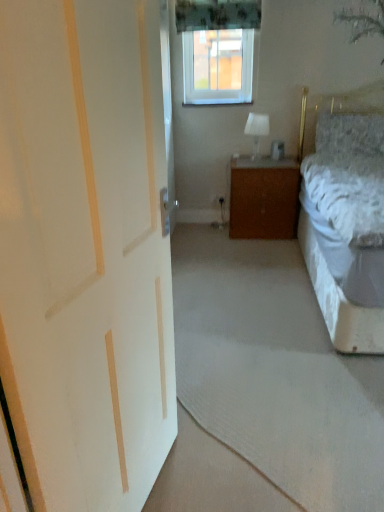
Where is `vacant space situated above wooden cabinet at center (from a real-world perspective)`? The width and height of the screenshot is (384, 512). vacant space situated above wooden cabinet at center (from a real-world perspective) is located at coordinates (261, 158).